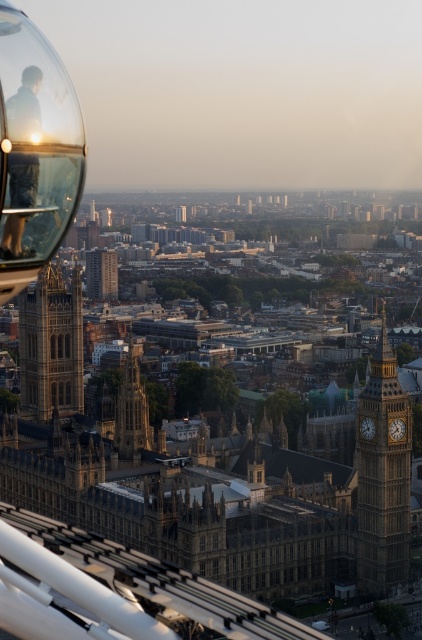
Question: Can you confirm if golden stone tower at center-left is wider than matte black jacket at upper left?

Choices:
 (A) yes
 (B) no

Answer: (A)

Question: Which point is farther to the camera?

Choices:
 (A) brown stone tower at center
 (B) matte black jacket at upper left
 (C) golden stone clock tower at right

Answer: (A)

Question: Which point appears farthest from the camera in this image?

Choices:
 (A) (27, 353)
 (B) (27, 202)
 (C) (386, 497)

Answer: (A)

Question: Considering the real-world distances, which object is closest to the brown stone tower at center?

Choices:
 (A) golden stone tower at center-left
 (B) golden stone clock tower at right

Answer: (A)

Question: Is golden stone tower at center-left closer to the viewer compared to matte black jacket at upper left?

Choices:
 (A) yes
 (B) no

Answer: (A)

Question: From the image, what is the correct spatial relationship of golden stone tower at center-left in relation to matte black jacket at upper left?

Choices:
 (A) left
 (B) right

Answer: (A)